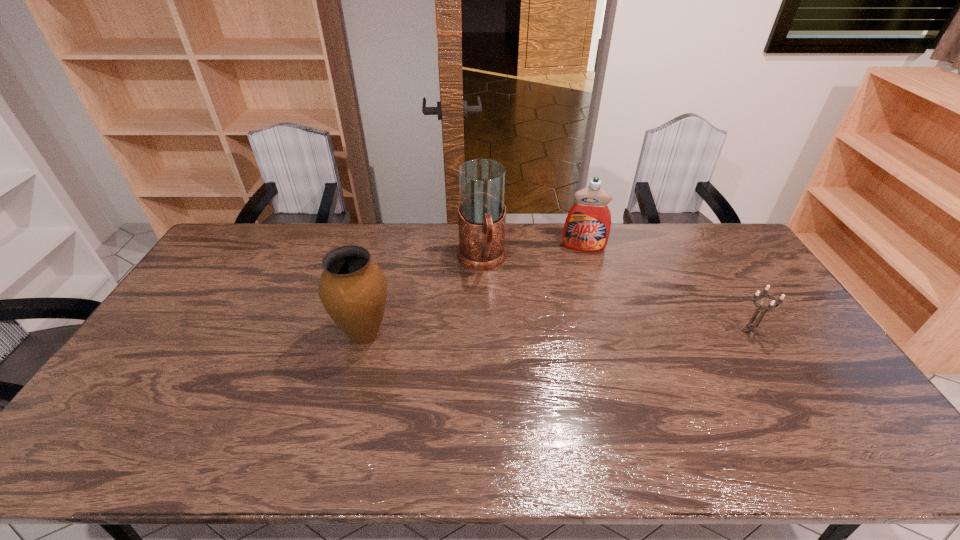
Where is `vacant region located with the handle on the side of the third object from right to left`? vacant region located with the handle on the side of the third object from right to left is located at coordinates (508, 366).

This screenshot has width=960, height=540. I want to click on vacant space situated 0.080m on the front surface of the second object from right to left, so click(x=583, y=267).

Locate an element on the screen. Image resolution: width=960 pixels, height=540 pixels. blank space located on the front surface of the second object from right to left is located at coordinates (585, 314).

Where is `vacant area situated on the front surface of the second object from right to left`? Image resolution: width=960 pixels, height=540 pixels. vacant area situated on the front surface of the second object from right to left is located at coordinates (585, 323).

The width and height of the screenshot is (960, 540). Find the location of `pitcher situated at the far edge`. pitcher situated at the far edge is located at coordinates (482, 213).

At what (x,y) coordinates should I click in order to perform the action: click on detergent that is at the far edge. Please return your answer as a coordinate pair (x, y). This screenshot has width=960, height=540. Looking at the image, I should click on pyautogui.click(x=587, y=227).

This screenshot has height=540, width=960. Identify the location of object present at the right edge. (770, 308).

Find the location of a particular element. The width and height of the screenshot is (960, 540). vacant space at the far edge is located at coordinates (x=313, y=262).

At what (x,y) coordinates should I click in order to perform the action: click on vacant region at the near edge of the desktop. Please return your answer as a coordinate pair (x, y). The height and width of the screenshot is (540, 960). Looking at the image, I should click on (429, 419).

The image size is (960, 540). In the image, there is a desktop. Find the location of `vacant region at the left edge`. vacant region at the left edge is located at coordinates (204, 345).